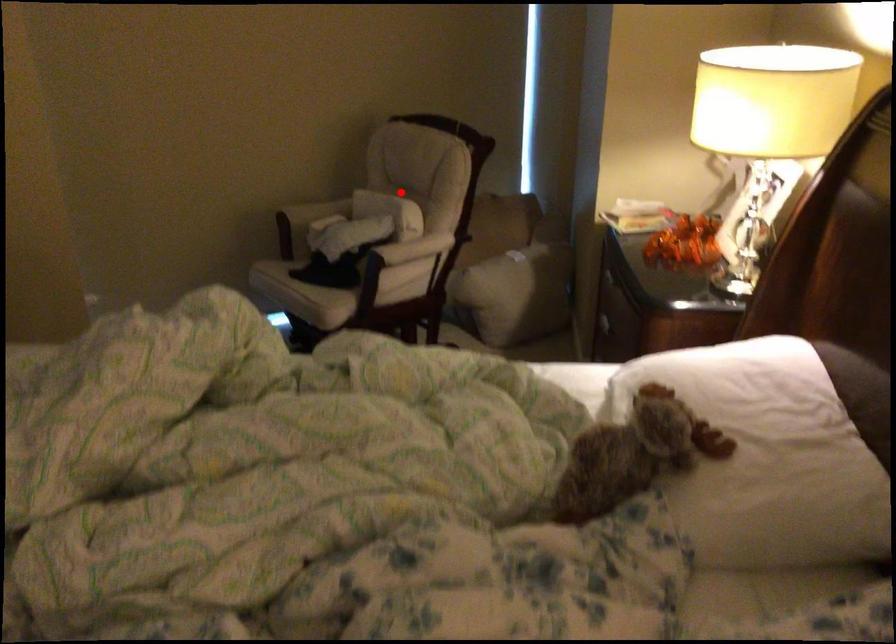
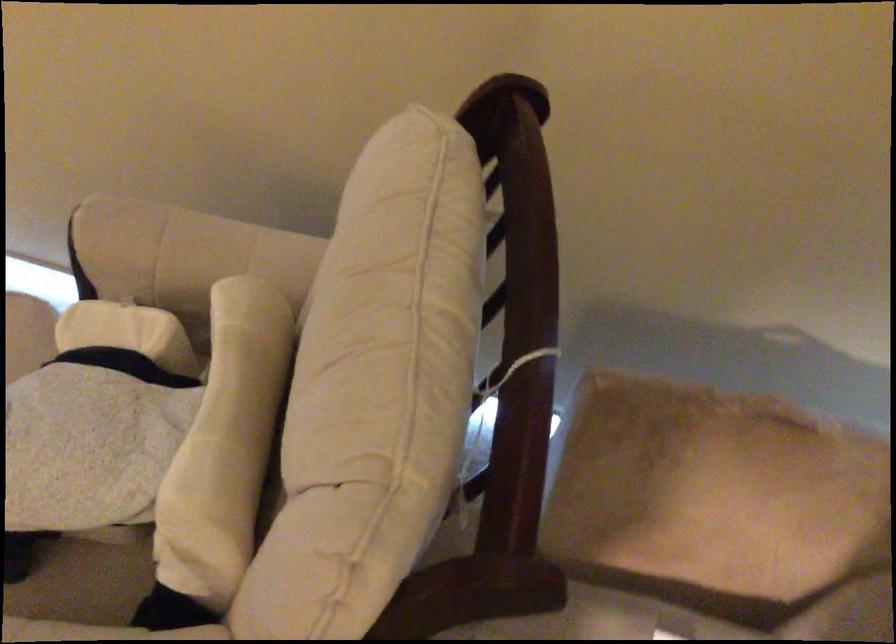
Find the pixel in the second image that matches the highlighted location in the first image.

(225, 444)